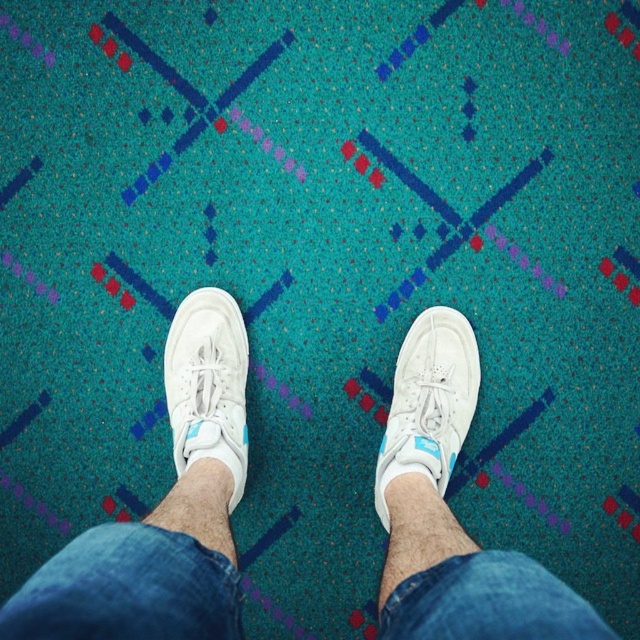
Between point (406, 420) and point (237, 406), which one is positioned in front?

Positioned in front is point (406, 420).

Does point (422, 451) lie behind point (176, 328)?

No, it is in front of (176, 328).

Is point (442, 353) positioned in front of point (234, 460)?

No, it is behind (234, 460).

You are a GUI agent. You are given a task and a screenshot of the screen. Output one action in this format:
    pyautogui.click(x=<x>, y=<y>)
    Task: Click on the white leather sneaker at center
    The image size is (640, 640).
    Given the screenshot: What is the action you would take?
    pyautogui.click(x=428, y=403)